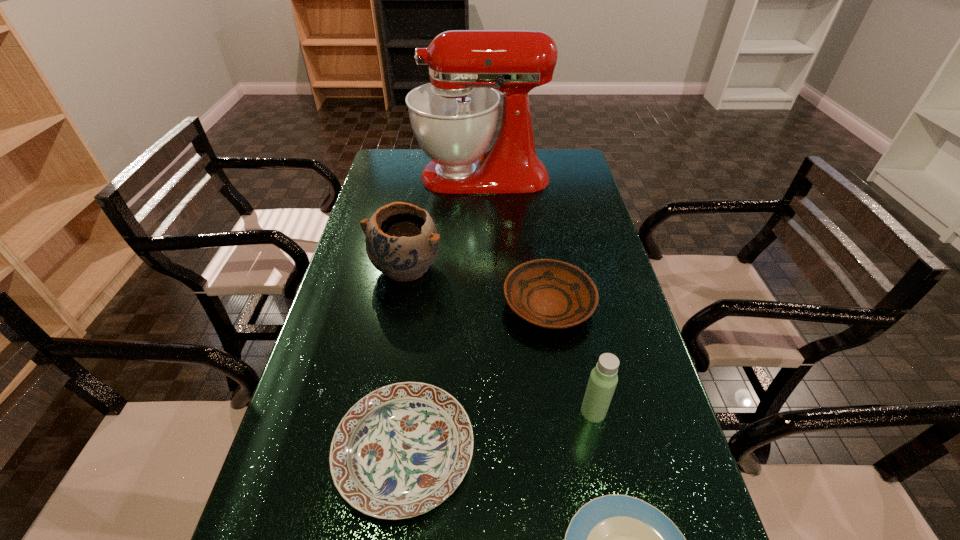
This screenshot has height=540, width=960. Find the location of `free space between the pottery and the farthest plate`. free space between the pottery and the farthest plate is located at coordinates (477, 286).

Find the location of a particular element. This screenshot has width=960, height=540. object that can be found as the closest to the tallest object is located at coordinates (402, 241).

Identify which object is located as the nearest to the farthest object. Please provide its 2D coordinates. Your answer should be formatted as a tuple, i.e. [(x, y)], where the tuple contains the x and y coordinates of a point satisfying the conditions above.

[(402, 241)]

Locate which plate is the third closest to the farthest object. Please provide its 2D coordinates. Your answer should be formatted as a tuple, i.e. [(x, y)], where the tuple contains the x and y coordinates of a point satisfying the conditions above.

[(614, 539)]

I want to click on plate that is the second closest one to the pottery, so click(400, 451).

Identify the location of free space that satisfies the following two spatial constraints: 1. on the back side of the second tallest plate; 2. on the left side of the thermos bottle. This screenshot has height=540, width=960. (411, 411).